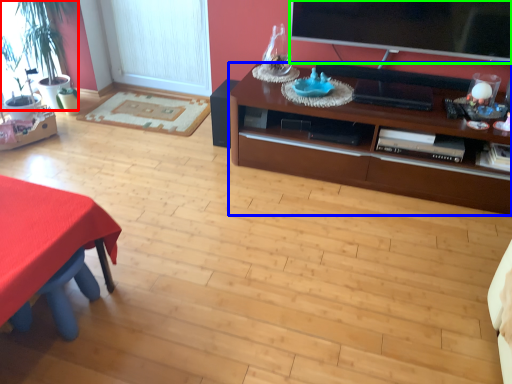
Question: Estimate the real-world distances between objects in this image. Which object is farther from houseplant (highlighted by a red box), cabinetry (highlighted by a blue box) or television (highlighted by a green box)?

Choices:
 (A) cabinetry
 (B) television

Answer: (B)